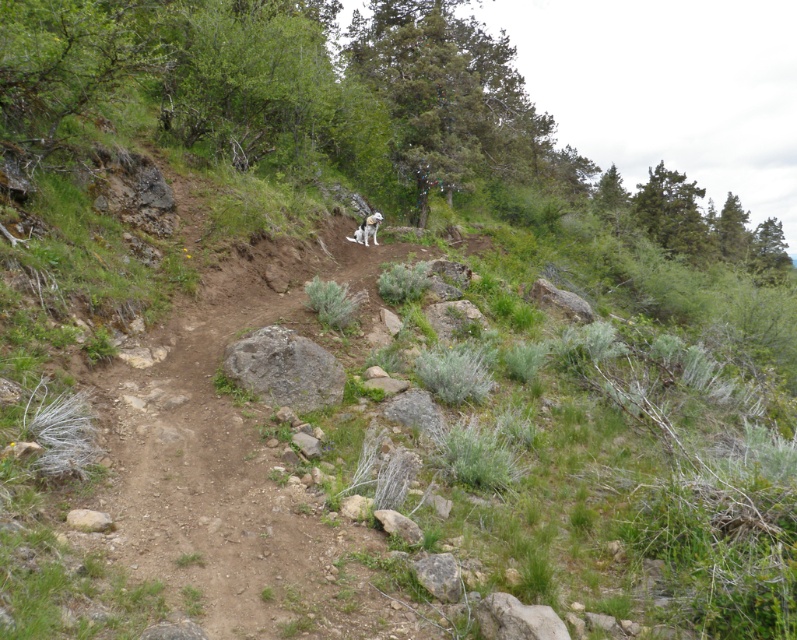
Question: Is dull brown dirt track at center to the right of gray rough rock at center from the viewer's perspective?

Choices:
 (A) no
 (B) yes

Answer: (B)

Question: Which point is farther to the camera?

Choices:
 (A) (370, 228)
 (B) (301, 362)
 (C) (253, 512)

Answer: (A)

Question: Which object is positioned closest to the white fur dog at center?

Choices:
 (A) gray rough rock at center
 (B) dull brown dirt track at center

Answer: (A)

Question: Does dull brown dirt track at center have a greater width compared to white fur dog at center?

Choices:
 (A) yes
 (B) no

Answer: (B)

Question: Is dull brown dirt track at center closer to camera compared to white fur dog at center?

Choices:
 (A) yes
 (B) no

Answer: (A)

Question: Among these objects, which one is farthest from the camera?

Choices:
 (A) dull brown dirt track at center
 (B) white fur dog at center
 (C) gray rough rock at center

Answer: (B)